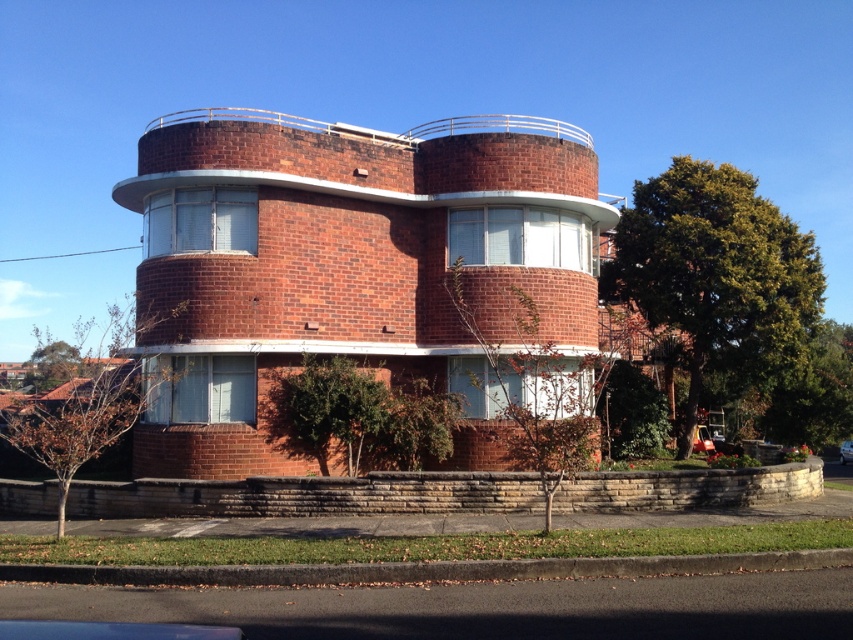
Question: Does metallic silver car at lower right come behind silver metallic car at center?

Choices:
 (A) no
 (B) yes

Answer: (A)

Question: Among these points, which one is farthest from the camera?

Choices:
 (A) (712, 452)
 (B) (842, 449)

Answer: (B)

Question: Is metallic silver car at lower right bigger than silver metallic car at center?

Choices:
 (A) yes
 (B) no

Answer: (B)

Question: Does metallic silver car at lower right appear under silver metallic car at center?

Choices:
 (A) no
 (B) yes

Answer: (A)